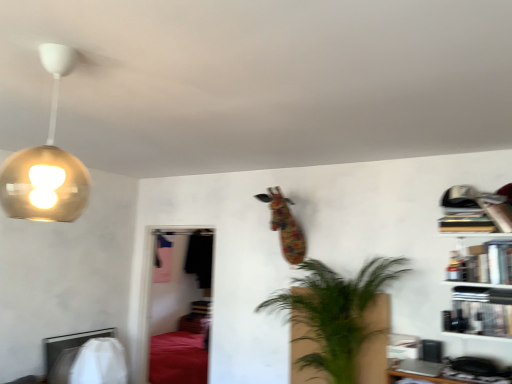
Question: Is hardcover books at upper right, the third book ordered from the bottom, far away from metallic silver book at right, placed as the 3th book when sorted from top to bottom?

Choices:
 (A) no
 (B) yes

Answer: (A)

Question: Is hardcover books at upper right, which is the 1th book in top-to-bottom order, directly adjacent to metallic silver book at right, placed as the 1th book when sorted from bottom to top?

Choices:
 (A) yes
 (B) no

Answer: (B)

Question: Can you confirm if hardcover books at upper right, the third book ordered from the bottom, is shorter than metallic silver book at right, placed as the 3th book when sorted from top to bottom?

Choices:
 (A) no
 (B) yes

Answer: (B)

Question: From the image's perspective, does hardcover books at upper right, the third book ordered from the bottom, appear lower than metallic silver book at right, placed as the 1th book when sorted from bottom to top?

Choices:
 (A) yes
 (B) no

Answer: (B)

Question: Is hardcover books at upper right, which is the 1th book in top-to-bottom order, not inside metallic silver book at right, placed as the 1th book when sorted from bottom to top?

Choices:
 (A) no
 (B) yes

Answer: (B)

Question: In the image, is hardcover book at upper right, marked as the 2th book in a top-to-bottom arrangement, positioned in front of or behind wooden bookshelf at right?

Choices:
 (A) front
 (B) behind

Answer: (B)

Question: Is hardcover book at upper right, marked as the 2th book in a top-to-bottom arrangement, inside or outside of wooden bookshelf at right?

Choices:
 (A) outside
 (B) inside

Answer: (B)

Question: Would you say hardcover book at upper right, marked as the 2th book in a top-to-bottom arrangement, is to the left or to the right of wooden bookshelf at right in the picture?

Choices:
 (A) right
 (B) left

Answer: (A)

Question: From a real-world perspective, is hardcover book at upper right, marked as the 2th book in a top-to-bottom arrangement, above or below wooden bookshelf at right?

Choices:
 (A) above
 (B) below

Answer: (A)

Question: Is metallic silver book at right, placed as the 3th book when sorted from top to bottom, spatially inside hardcover book at upper right, positioned as the 2th book in bottom-to-top order, or outside of it?

Choices:
 (A) inside
 (B) outside

Answer: (B)

Question: In terms of size, does metallic silver book at right, placed as the 3th book when sorted from top to bottom, appear bigger or smaller than hardcover book at upper right, positioned as the 2th book in bottom-to-top order?

Choices:
 (A) big
 (B) small

Answer: (B)

Question: In terms of height, does metallic silver book at right, placed as the 3th book when sorted from top to bottom, look taller or shorter compared to hardcover book at upper right, positioned as the 2th book in bottom-to-top order?

Choices:
 (A) tall
 (B) short

Answer: (B)

Question: In terms of width, does metallic silver book at right, placed as the 1th book when sorted from bottom to top, look wider or thinner when compared to hardcover book at upper right, marked as the 2th book in a top-to-bottom arrangement?

Choices:
 (A) thin
 (B) wide

Answer: (A)

Question: In terms of width, does hardcover books at upper right, which is the 1th book in top-to-bottom order, look wider or thinner when compared to hardcover book at upper right, marked as the 2th book in a top-to-bottom arrangement?

Choices:
 (A) wide
 (B) thin

Answer: (A)

Question: From a real-world perspective, is hardcover books at upper right, the third book ordered from the bottom, above or below hardcover book at upper right, positioned as the 2th book in bottom-to-top order?

Choices:
 (A) above
 (B) below

Answer: (A)